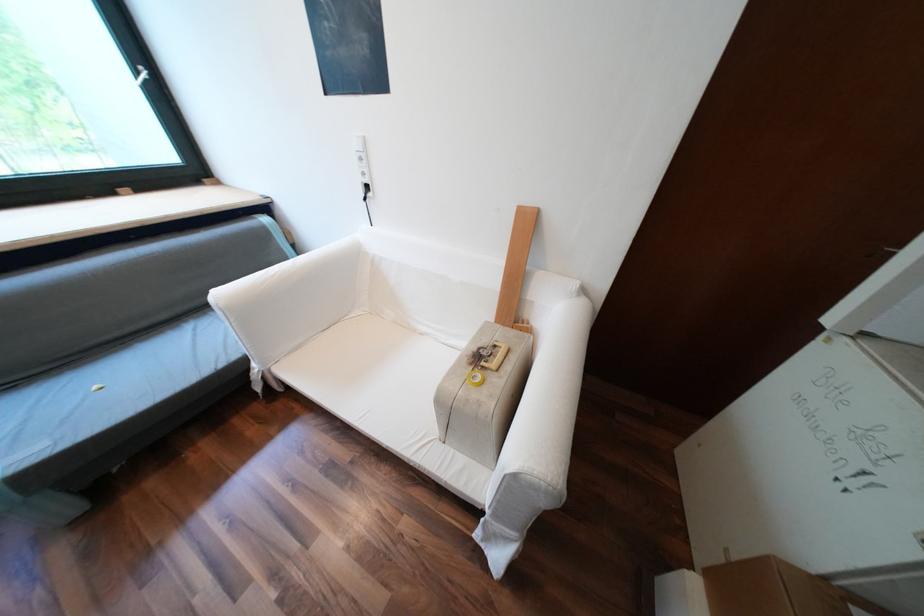
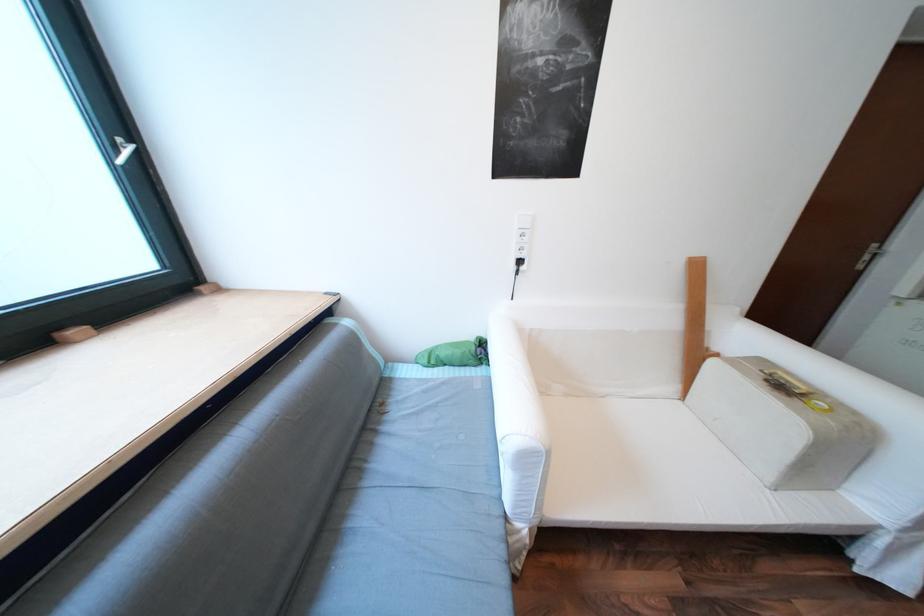
Question: What movement of the cameraman would produce the second image?

Choices:
 (A) Left
 (B) Right
 (C) Forward
 (D) Backward

Answer: (A)